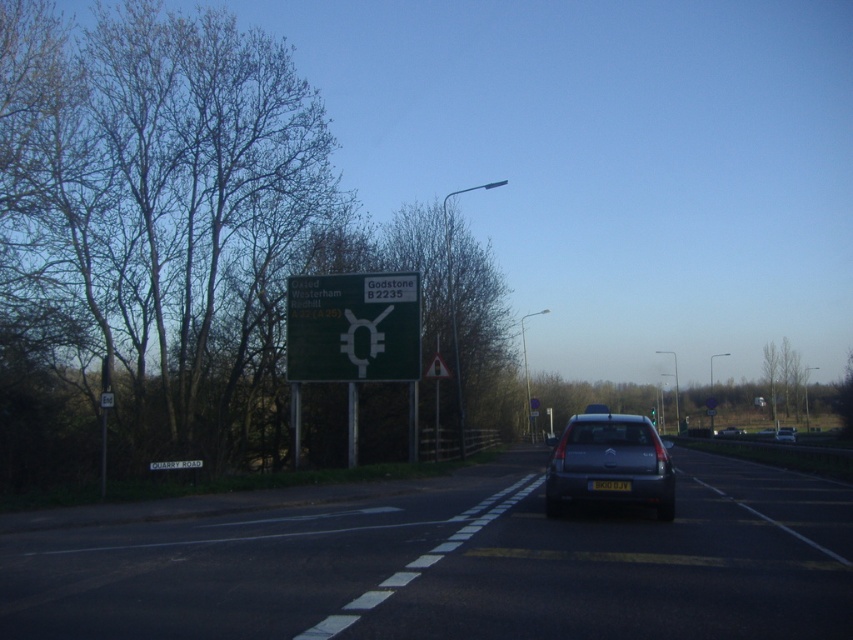
You are a pedestrian standing at the edge of the road. You see the black plastic license plate at center and the silver metallic sedan at center. Which object is closer to you?

The black plastic license plate at center is closer to you since it is only 53.23 meters away from the silver metallic sedan at center, but without knowing your exact position, we can infer that the license plate is part of the sedan, so they are likely at the same distance from you.